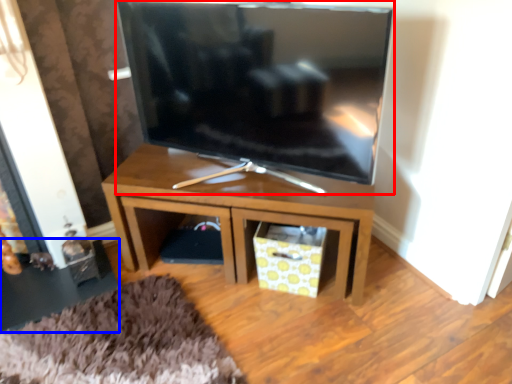
Question: Which of the following is the farthest to the observer, television (highlighted by a red box) or side table (highlighted by a blue box)?

Choices:
 (A) television
 (B) side table

Answer: (B)